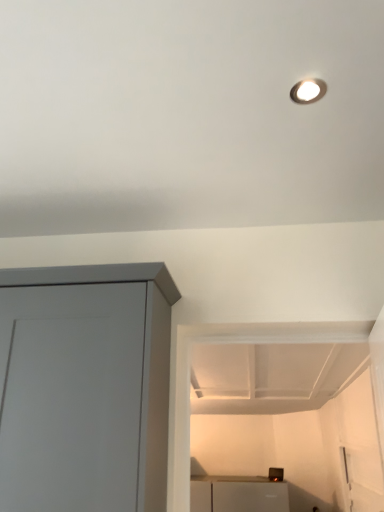
Question: Is metallic silver toaster at lower center far from matte gray cupboard at left?

Choices:
 (A) yes
 (B) no

Answer: (A)

Question: From a real-world perspective, is metallic silver toaster at lower center located higher than matte gray cupboard at left?

Choices:
 (A) yes
 (B) no

Answer: (B)

Question: Are metallic silver toaster at lower center and matte gray cupboard at left beside each other?

Choices:
 (A) yes
 (B) no

Answer: (B)

Question: Is metallic silver toaster at lower center shorter than matte gray cupboard at left?

Choices:
 (A) yes
 (B) no

Answer: (A)

Question: From the image's perspective, is metallic silver toaster at lower center over matte gray cupboard at left?

Choices:
 (A) no
 (B) yes

Answer: (A)

Question: Considering the relative sizes of metallic silver toaster at lower center and matte gray cupboard at left in the image provided, is metallic silver toaster at lower center thinner than matte gray cupboard at left?

Choices:
 (A) yes
 (B) no

Answer: (A)

Question: Is metallic silver toaster at lower center at the back of matte gray cupboard at left?

Choices:
 (A) yes
 (B) no

Answer: (A)

Question: Is the position of matte gray cupboard at left more distant than that of metallic silver toaster at lower center?

Choices:
 (A) yes
 (B) no

Answer: (B)

Question: From the image's perspective, would you say matte gray cupboard at left is positioned over metallic silver toaster at lower center?

Choices:
 (A) no
 (B) yes

Answer: (B)

Question: Does matte gray cupboard at left have a smaller size compared to metallic silver toaster at lower center?

Choices:
 (A) yes
 (B) no

Answer: (B)

Question: From the image's perspective, is matte gray cupboard at left below metallic silver toaster at lower center?

Choices:
 (A) yes
 (B) no

Answer: (B)

Question: Could you tell me if matte gray cupboard at left is facing metallic silver toaster at lower center?

Choices:
 (A) yes
 (B) no

Answer: (B)

Question: Is matte gray cupboard at left bigger or smaller than metallic silver toaster at lower center?

Choices:
 (A) big
 (B) small

Answer: (A)